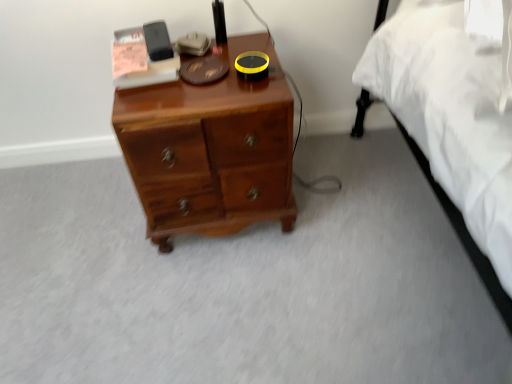
The height and width of the screenshot is (384, 512). In order to click on vacant area on top of shiny wood chest of drawers at center (from a real-world perspective) in this screenshot , I will do `click(203, 71)`.